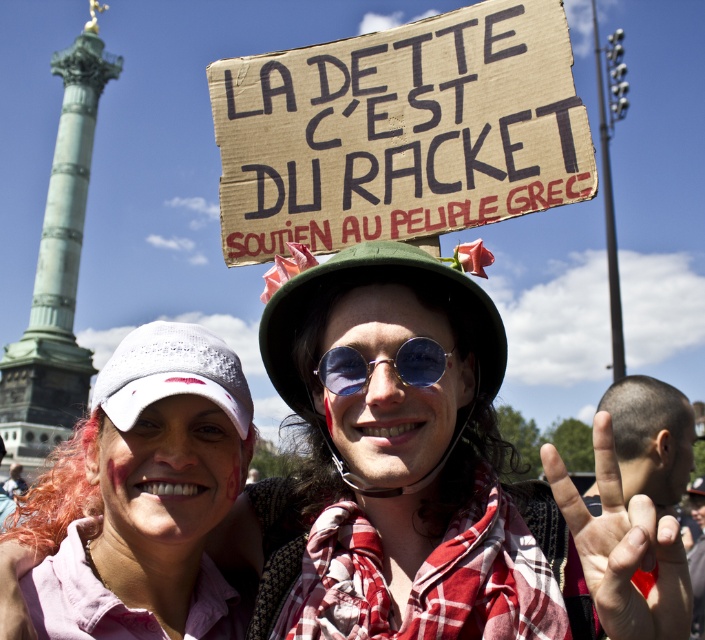
Who is positioned more to the left, matte pink shirt at center or pink fabric shirt at center?

pink fabric shirt at center is more to the left.

Between matte pink shirt at center and pink fabric shirt at center, which one appears on the right side from the viewer's perspective?

From the viewer's perspective, matte pink shirt at center appears more on the right side.

What are the coordinates of `matte pink shirt at center` in the screenshot? It's located at (380, 428).

Image resolution: width=705 pixels, height=640 pixels. Identify the location of matte pink shirt at center. (380, 428).

Which is more to the right, brown cardboard sign at upper center or pink fabric shirt at center?

From the viewer's perspective, brown cardboard sign at upper center appears more on the right side.

Who is shorter, brown cardboard sign at upper center or pink fabric shirt at center?

With less height is brown cardboard sign at upper center.

You are a GUI agent. You are given a task and a screenshot of the screen. Output one action in this format:
    pyautogui.click(x=<x>, y=<y>)
    Task: Click on the brown cardboard sign at upper center
    
    Given the screenshot: What is the action you would take?
    pyautogui.click(x=398, y=131)

Where is `brown cardboard sign at upper center`? This screenshot has height=640, width=705. brown cardboard sign at upper center is located at coordinates (398, 131).

Does point (271, 106) come farther from viewer compared to point (398, 355)?

Yes, it is behind point (398, 355).

Between brown cardboard sign at upper center and blue reflective sunglasses at center, which one is positioned higher?

brown cardboard sign at upper center is higher up.

Is point (439, 24) positioned after point (314, 372)?

No, it is in front of (314, 372).

Find the location of a particular element. brown cardboard sign at upper center is located at coordinates (398, 131).